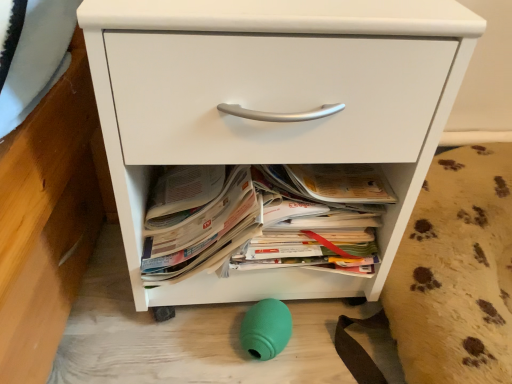
The width and height of the screenshot is (512, 384). Describe the element at coordinates (273, 107) in the screenshot. I see `white matte drawer at center` at that location.

I want to click on white matte drawer at center, so click(x=273, y=107).

Identify the location of white matte drawer at center. (273, 107).